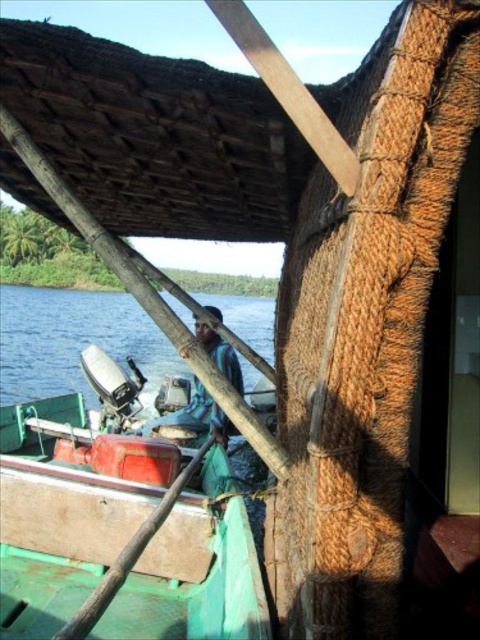
Is point (213, 452) positioned in front of point (216, 428)?

That is True.

Is green matte boat at center shorter than blue fabric shirt at center?

Correct, green matte boat at center is not as tall as blue fabric shirt at center.

Is point (118, 572) less distant than point (196, 428)?

Yes, point (118, 572) is in front of point (196, 428).

The image size is (480, 640). I want to click on green matte boat at center, so click(x=120, y=522).

Which is above, blue water at lower left or blue fabric shirt at center?

blue water at lower left

Is blue water at lower left in front of blue fabric shirt at center?

That is False.

Is point (9, 346) farther from camera compared to point (208, 339)?

That is True.

Where is `blue water at lower left`? blue water at lower left is located at coordinates (74, 340).

Can you confirm if green matte boat at center is positioned to the right of blue water at lower left?

Indeed, green matte boat at center is positioned on the right side of blue water at lower left.

Is point (11, 525) behind point (16, 308)?

That is False.

Between point (135, 401) and point (40, 374), which one is positioned in front?

Point (135, 401) is in front.

Find the location of a particular element. green matte boat at center is located at coordinates (120, 522).